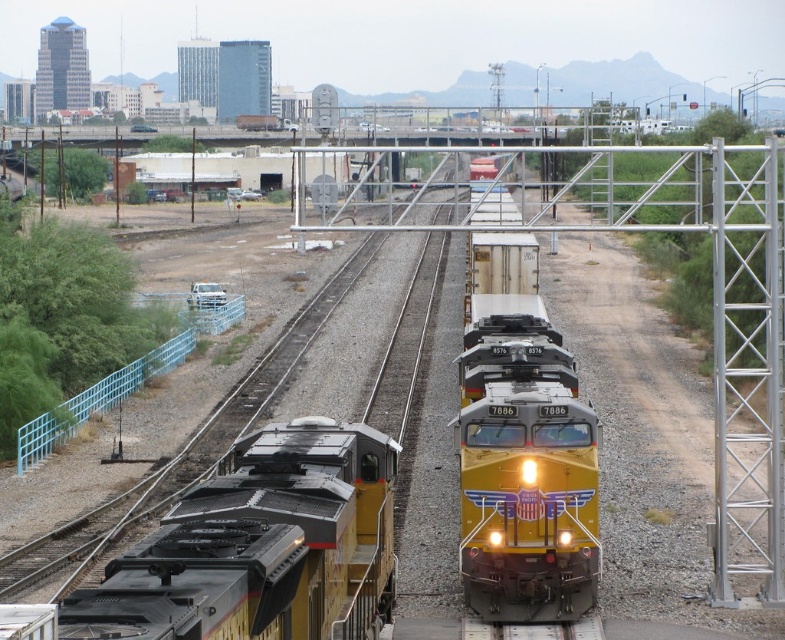
You are a railway worker who needs to inspect both the yellow matte train car at lower left and the yellow metallic train at center. Given that your inspection tool has a maximum reach of 30 feet, can you inspect both trains without moving closer than their current distance?

The yellow matte train car at lower left and yellow metallic train at center are 31.26 feet apart, which exceeds the inspection tool maximum reach of 30 feet. Therefore, you cannot inspect both trains without moving closer.

Looking at this image, you are a railway engineer inspecting the tracks. You notice two trains approaching from opposite directions. The yellow matte train car at lower left and the yellow metallic train at center are both on parallel tracks. Which train has a narrower width according to the scene?

The yellow matte train car at lower left is thinner than the yellow metallic train at center, so the yellow matte train car at lower left has a narrower width.

From the picture: You are a railway engineer assessing the layout of the tracks. You notice the yellow matte train car at lower left and the yellow metallic train at center. Which one is located closer to the ground?

The yellow matte train car at lower left is positioned under the yellow metallic train at center, so it is closer to the ground.